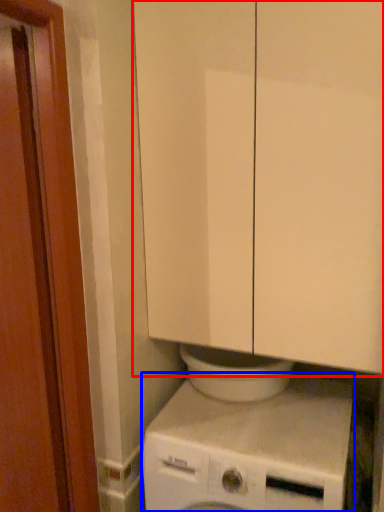
Question: Among these objects, which one is farthest to the camera, cabinetry (highlighted by a red box) or washing machine (highlighted by a blue box)?

Choices:
 (A) cabinetry
 (B) washing machine

Answer: (B)